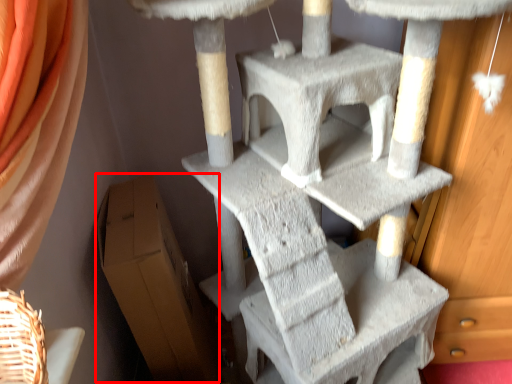
Question: In this image, where is cardboard box (annotated by the red box) located relative to furniture?

Choices:
 (A) right
 (B) left

Answer: (B)